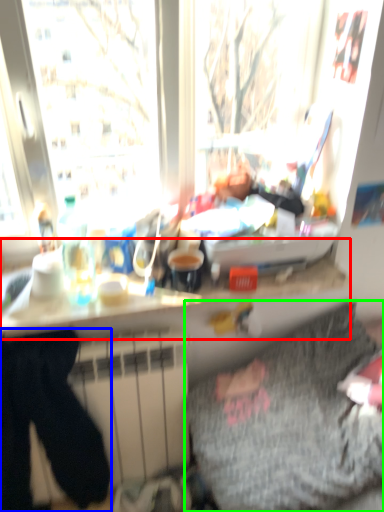
Question: Estimate the real-world distances between objects in this image. Which object is farther from counter top (highlighted by a red box), sweat pant (highlighted by a blue box) or bedding (highlighted by a green box)?

Choices:
 (A) sweat pant
 (B) bedding

Answer: (B)